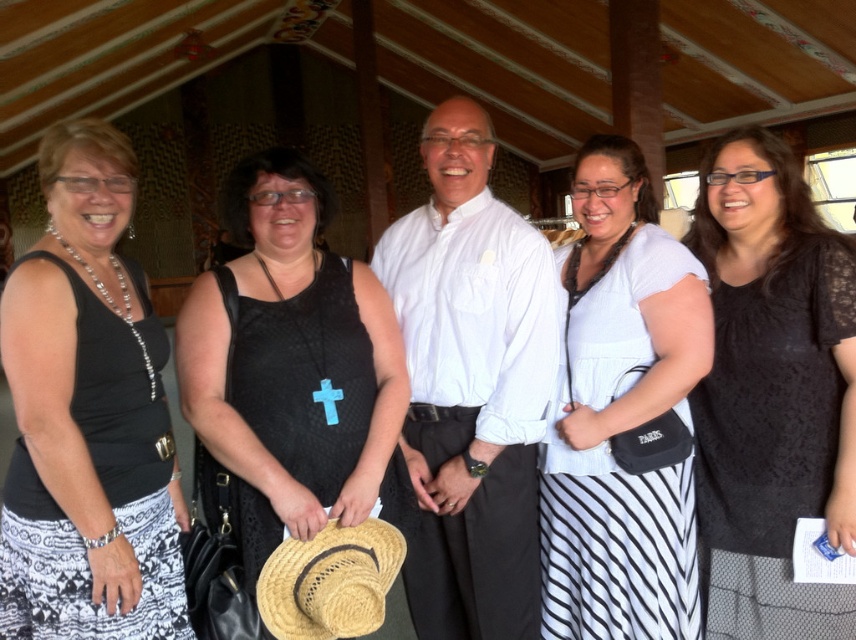
Question: Among these objects, which one is farthest from the camera?

Choices:
 (A) white striped skirt at center
 (B) black lace dress at center

Answer: (A)

Question: Is black lace dress at center positioned before straw hat at center?

Choices:
 (A) no
 (B) yes

Answer: (A)

Question: Which is nearer to the black matte tank top at left?

Choices:
 (A) black lace dress at center
 (B) black mesh dress at center

Answer: (B)

Question: Does black lace dress at center have a larger size compared to black mesh dress at center?

Choices:
 (A) yes
 (B) no

Answer: (B)

Question: Which point is farther to the camera?

Choices:
 (A) black matte tank top at left
 (B) white striped skirt at center
 (C) straw hat at center

Answer: (B)

Question: In this image, where is black lace dress at center located relative to black mesh dress at center?

Choices:
 (A) above
 (B) below

Answer: (B)